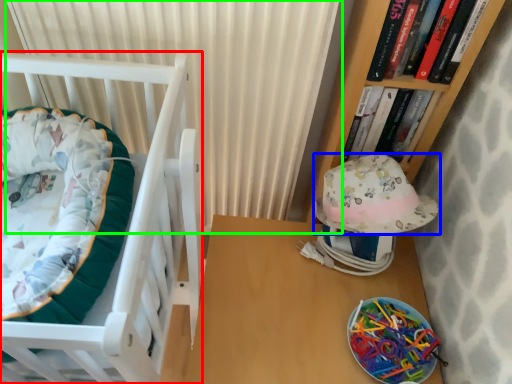
Question: Based on their relative distances, which object is nearer to furniture (highlighted by a red box)? Choose from hat (highlighted by a blue box) and curtain (highlighted by a green box).

Choices:
 (A) hat
 (B) curtain

Answer: (B)